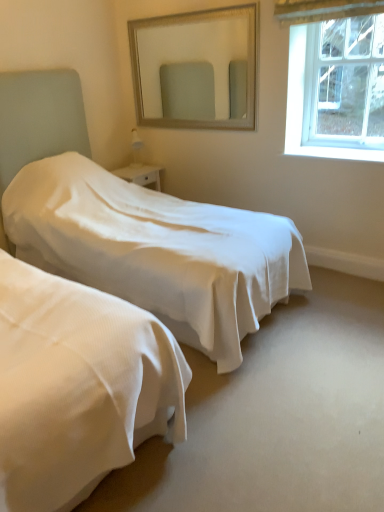
Question: From a real-world perspective, is white smooth bed at center above or below clear glass window at upper right?

Choices:
 (A) below
 (B) above

Answer: (A)

Question: Which is correct: white smooth bed at center is inside clear glass window at upper right, or outside of it?

Choices:
 (A) inside
 (B) outside

Answer: (B)

Question: Which is nearer to the silver textured mirror at upper center?

Choices:
 (A) white smooth bed at center
 (B) clear glass window at upper right

Answer: (B)

Question: Estimate the real-world distances between objects in this image. Which object is closer to the silver textured mirror at upper center?

Choices:
 (A) white smooth bed at center
 (B) clear glass window at upper right

Answer: (B)